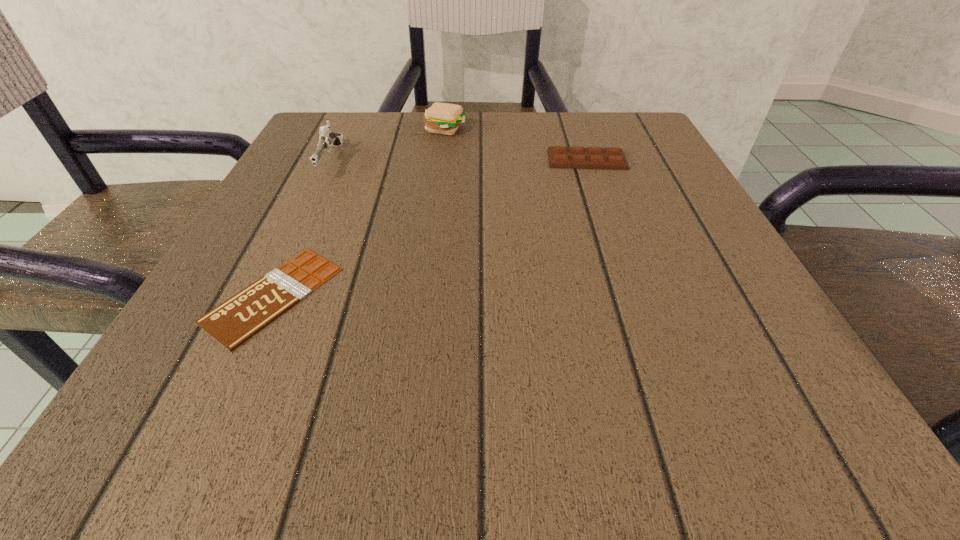
Locate an element on the screen. vacant region between the nearest object and the second tallest object is located at coordinates (360, 212).

Identify the location of vacant area between the left chocolate bar and the farther chocolate bar. (430, 227).

The height and width of the screenshot is (540, 960). In order to click on blank region between the farthest object and the tallest object in this screenshot , I will do `click(388, 145)`.

Locate an element on the screen. This screenshot has width=960, height=540. unoccupied area between the nearest object and the tallest object is located at coordinates (302, 228).

Where is `the third closest object to the shortest object`? the third closest object to the shortest object is located at coordinates (612, 158).

Locate an element on the screen. The width and height of the screenshot is (960, 540). the third closest object to the farthest object is located at coordinates (237, 319).

At what (x,y) coordinates should I click in order to perform the action: click on vacant region that satisfies the following two spatial constraints: 1. aimed along the barrel of the tallest object; 2. on the left side of the nearer chocolate bar. Please return your answer as a coordinate pair (x, y). The image size is (960, 540). Looking at the image, I should click on (266, 295).

The height and width of the screenshot is (540, 960). What are the coordinates of `vacant space that satisfies the following two spatial constraints: 1. aimed along the barrel of the tallest object; 2. on the left side of the left chocolate bar` in the screenshot? It's located at (266, 295).

The image size is (960, 540). In order to click on vacant space that satisfies the following two spatial constraints: 1. aimed along the barrel of the shortest object; 2. on the right side of the gun in this screenshot , I will do `click(266, 295)`.